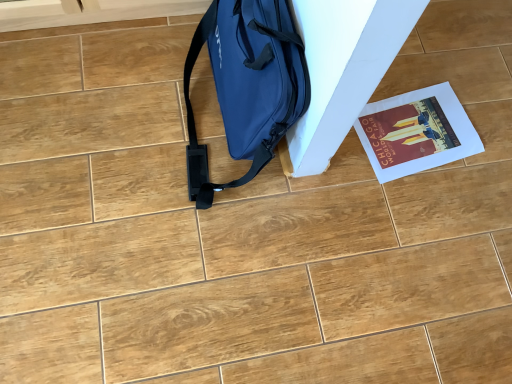
Question: From the image's perspective, is matte paper poster at lower right above or below matte blue bag at center-left?

Choices:
 (A) above
 (B) below

Answer: (B)

Question: From a real-world perspective, is matte paper poster at lower right above or below matte blue bag at center-left?

Choices:
 (A) above
 (B) below

Answer: (B)

Question: In the image, is matte paper poster at lower right on the left side or the right side of matte blue bag at center-left?

Choices:
 (A) left
 (B) right

Answer: (B)

Question: From a real-world perspective, relative to matte paper poster at lower right, is matte blue bag at center-left vertically above or below?

Choices:
 (A) below
 (B) above

Answer: (B)

Question: In terms of width, does matte blue bag at center-left look wider or thinner when compared to matte paper poster at lower right?

Choices:
 (A) wide
 (B) thin

Answer: (B)

Question: Based on their sizes in the image, would you say matte blue bag at center-left is bigger or smaller than matte paper poster at lower right?

Choices:
 (A) small
 (B) big

Answer: (B)

Question: Is matte blue bag at center-left taller or shorter than matte paper poster at lower right?

Choices:
 (A) tall
 (B) short

Answer: (A)